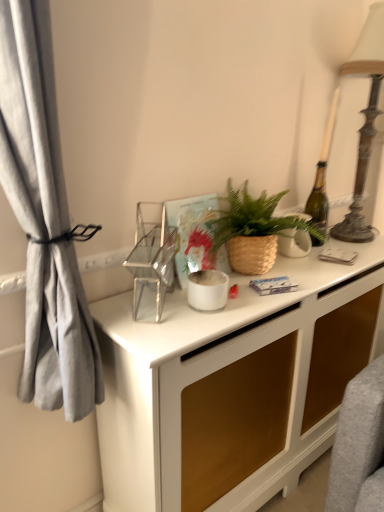
Question: Is white ceramic vase at center, positioned as the first appliance in back-to-front order, located within white matte pot at center, acting as the 2th appliance starting from the left?

Choices:
 (A) yes
 (B) no

Answer: (B)

Question: From a real-world perspective, is white matte pot at center, acting as the 2th appliance starting from the left, over white ceramic vase at center, the 3th appliance when ordered from left to right?

Choices:
 (A) yes
 (B) no

Answer: (B)

Question: Does white matte pot at center, which is the 2th appliance in right-to-left order, appear on the right side of white ceramic vase at center, which is counted as the third appliance, starting from the front?

Choices:
 (A) no
 (B) yes

Answer: (A)

Question: Does white matte pot at center, which is the 2th appliance in right-to-left order, have a greater height compared to white ceramic vase at center, marked as the 1th appliance in a right-to-left arrangement?

Choices:
 (A) no
 (B) yes

Answer: (A)

Question: Considering the relative sizes of white matte pot at center, which is the 2th appliance in right-to-left order, and white ceramic vase at center, positioned as the first appliance in back-to-front order, in the image provided, is white matte pot at center, which is the 2th appliance in right-to-left order, wider than white ceramic vase at center, positioned as the first appliance in back-to-front order,?

Choices:
 (A) no
 (B) yes

Answer: (B)

Question: Considering the positions of white matte pot at center, which is the 2th appliance in right-to-left order, and white ceramic vase at center, which is counted as the third appliance, starting from the front, in the image, is white matte pot at center, which is the 2th appliance in right-to-left order, wider or thinner than white ceramic vase at center, which is counted as the third appliance, starting from the front,?

Choices:
 (A) thin
 (B) wide

Answer: (B)

Question: Considering the positions of white matte pot at center, positioned as the second appliance in back-to-front order, and white ceramic vase at center, marked as the 1th appliance in a right-to-left arrangement, in the image, is white matte pot at center, positioned as the second appliance in back-to-front order, bigger or smaller than white ceramic vase at center, marked as the 1th appliance in a right-to-left arrangement,?

Choices:
 (A) small
 (B) big

Answer: (A)

Question: Is white matte pot at center, acting as the 2th appliance starting from the left, spatially inside white ceramic vase at center, the 3th appliance when ordered from left to right, or outside of it?

Choices:
 (A) inside
 (B) outside

Answer: (B)

Question: From the image's perspective, is white matte pot at center, positioned as the second appliance in back-to-front order, located above or below white ceramic vase at center, positioned as the first appliance in back-to-front order?

Choices:
 (A) above
 (B) below

Answer: (B)

Question: From a real-world perspective, is white ceramic vase at center, the 3th appliance when ordered from left to right, above or below clear glass shelf at center, placed as the first appliance when sorted from left to right?

Choices:
 (A) below
 (B) above

Answer: (A)

Question: In the image, is white ceramic vase at center, the 3th appliance when ordered from left to right, on the left side or the right side of clear glass shelf at center, the first appliance viewed from the front?

Choices:
 (A) right
 (B) left

Answer: (A)

Question: From the image's perspective, relative to clear glass shelf at center, positioned as the 3th appliance in right-to-left order, is white ceramic vase at center, positioned as the first appliance in back-to-front order, above or below?

Choices:
 (A) below
 (B) above

Answer: (B)

Question: In the image, is white ceramic vase at center, the 3th appliance when ordered from left to right, positioned in front of or behind clear glass shelf at center, positioned as the 3th appliance in right-to-left order?

Choices:
 (A) front
 (B) behind

Answer: (B)

Question: In terms of size, does white ceramic vase at center, the 3th appliance when ordered from left to right, appear bigger or smaller than brown woven basket at center?

Choices:
 (A) small
 (B) big

Answer: (A)

Question: Is white ceramic vase at center, marked as the 1th appliance in a right-to-left arrangement, in front of or behind brown woven basket at center in the image?

Choices:
 (A) behind
 (B) front

Answer: (A)